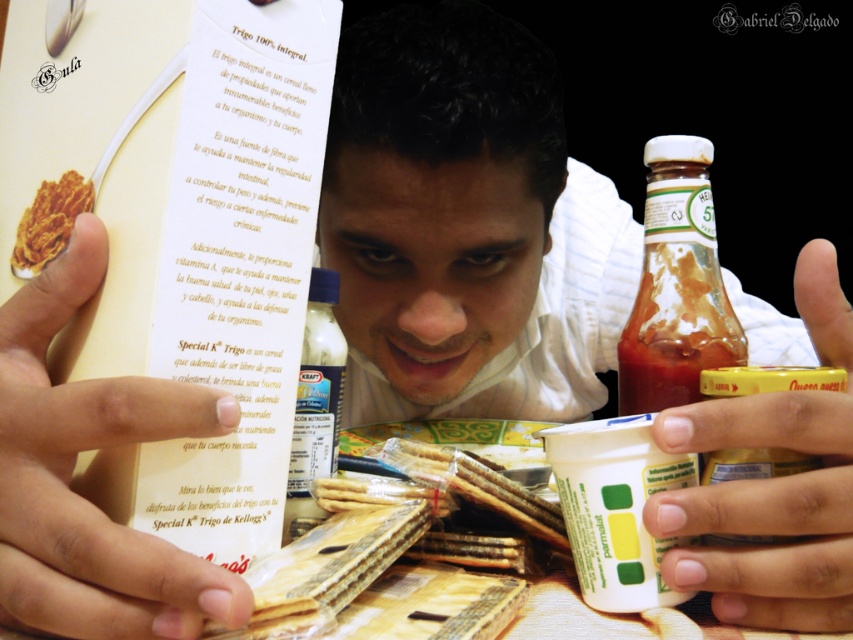
Question: Is yellow matte jar at lower right positioned before translucent glass bottle at upper right?

Choices:
 (A) no
 (B) yes

Answer: (B)

Question: Which of the following is the closest to the observer?

Choices:
 (A) yellow matte jar at lower right
 (B) smooth skin face at center
 (C) translucent glass bottle at upper right

Answer: (A)

Question: Which point appears closest to the camera in this image?

Choices:
 (A) pos(602,371)
 (B) pos(335,456)
 (C) pos(845,468)

Answer: (C)

Question: Does white matte finger at center have a greater width compared to translucent plastic bottle at center?

Choices:
 (A) yes
 (B) no

Answer: (A)

Question: Which point is farther to the camera?

Choices:
 (A) translucent plastic bottle at center
 (B) smooth skin face at center

Answer: (A)

Question: Observing the image, what is the correct spatial positioning of white matte finger at center in reference to translucent plastic bottle at center?

Choices:
 (A) left
 (B) right

Answer: (A)